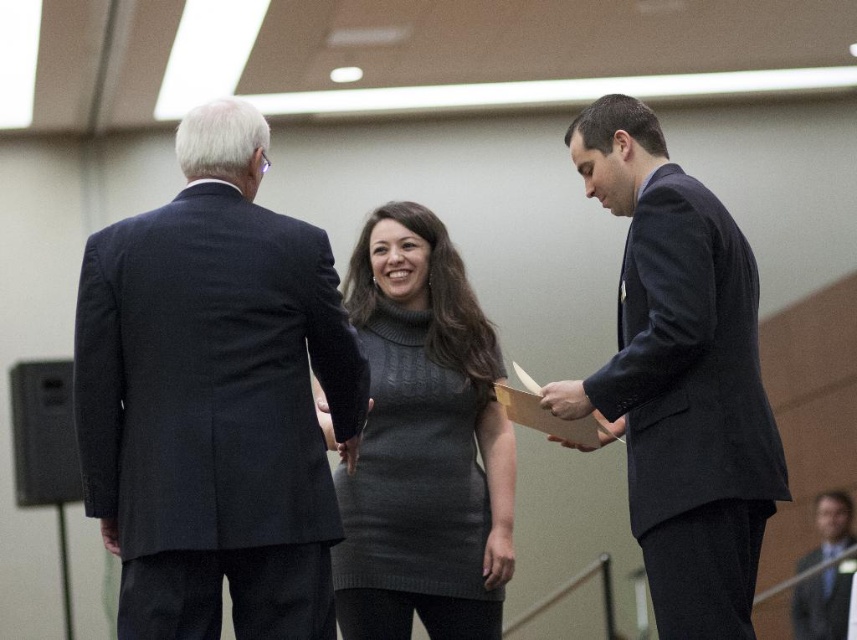
Is dark blue suit at left to the right of dark blue suit at right from the viewer's perspective?

In fact, dark blue suit at left is to the left of dark blue suit at right.

Who is lower down, dark blue suit at left or dark blue suit at right?

dark blue suit at left is below.

Locate an element on the screen. This screenshot has width=857, height=640. dark blue suit at left is located at coordinates (214, 397).

What are the coordinates of `dark blue suit at left` in the screenshot? It's located at (214, 397).

Is the position of dark blue suit at right more distant than that of dark blue suit at center?

No.

Does point (610, 205) lie in front of point (811, 552)?

Yes, it is.

You are a GUI agent. You are given a task and a screenshot of the screen. Output one action in this format:
    pyautogui.click(x=<x>, y=<y>)
    Task: Click on the dark blue suit at right
    
    Given the screenshot: What is the action you would take?
    pyautogui.click(x=680, y=378)

Who is positioned more to the left, dark blue suit at right or gray knitted dress at center?

gray knitted dress at center is more to the left.

Consider the image. Can you confirm if dark blue suit at right is smaller than gray knitted dress at center?

Yes.

What do you see at coordinates (680, 378) in the screenshot? I see `dark blue suit at right` at bounding box center [680, 378].

Find the location of a particular element. dark blue suit at right is located at coordinates click(680, 378).